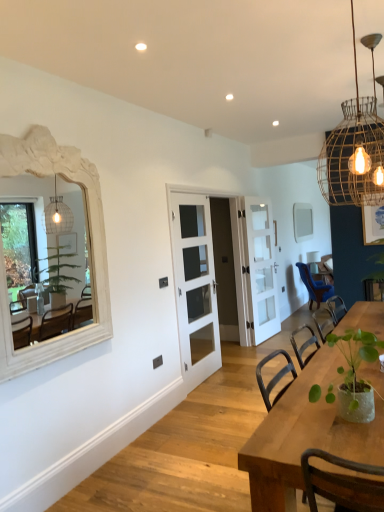
The image size is (384, 512). Describe the element at coordinates (261, 268) in the screenshot. I see `white glossy door at center, placed as the third door when sorted from front to back` at that location.

What is the approximate width of white glass door at center, the first door positioned from the front?

The width of white glass door at center, the first door positioned from the front, is 3.09 inches.

This screenshot has height=512, width=384. Identify the location of white glossy door at center, placed as the third door when sorted from front to back. (261, 268).

Looking at this image, based on their positions, is wooden table at center located to the left or right of green matte plant at lower right?

From the image, it's evident that wooden table at center is to the right of green matte plant at lower right.

Is wooden table at center inside or outside of green matte plant at lower right?

wooden table at center is spatially situated outside green matte plant at lower right.

From the image's perspective, is wooden table at center on top of green matte plant at lower right?

No, from the image's perspective, wooden table at center is not over green matte plant at lower right.

The image size is (384, 512). There is a white glass door at center, the 3th door positioned from the back. Find the location of `the 1st mirror above it (from the image's perspective)`. the 1st mirror above it (from the image's perspective) is located at coordinates (90, 246).

Which point is more forward, (245, 345) or (6, 320)?

Point (6, 320)

Is white glass door at center, the 3th door positioned from the back, spatially inside white carved wood mirror at left, arranged as the first mirror when viewed from the front, or outside of it?

white glass door at center, the 3th door positioned from the back, cannot be found inside white carved wood mirror at left, arranged as the first mirror when viewed from the front.

Could you measure the distance between white glass door at center, the 3th door positioned from the back, and white carved wood mirror at left, which appears as the second mirror when viewed from the right?

white glass door at center, the 3th door positioned from the back, is 4.66 feet away from white carved wood mirror at left, which appears as the second mirror when viewed from the right.

What's the angular difference between green matte plant at lower right and white carved wood mirror at left, arranged as the first mirror when viewed from the front,'s facing directions?

The angular difference between green matte plant at lower right and white carved wood mirror at left, arranged as the first mirror when viewed from the front, is 86.1 degrees.

Between green matte plant at lower right and white carved wood mirror at left, which appears as the second mirror when viewed from the right, which one appears on the left side from the viewer's perspective?

white carved wood mirror at left, which appears as the second mirror when viewed from the right, is more to the left.

Is green matte plant at lower right wider than white carved wood mirror at left, the 1th mirror when ordered from left to right?

Yes.

Looking at this image, is green matte plant at lower right inside or outside of white carved wood mirror at left, arranged as the first mirror when viewed from the front?

green matte plant at lower right is outside white carved wood mirror at left, arranged as the first mirror when viewed from the front.

Based on the photo, is green matte plant at lower right smaller than wooden table at center?

Correct, green matte plant at lower right occupies less space than wooden table at center.

Considering the sizes of objects green matte plant at lower right and wooden table at center in the image provided, who is thinner, green matte plant at lower right or wooden table at center?

green matte plant at lower right is thinner.

Is wooden table at center at the back of green matte plant at lower right?

Yes, green matte plant at lower right is positioned with its back facing wooden table at center.

Is green matte plant at lower right directly adjacent to wooden table at center?

green matte plant at lower right and wooden table at center are clearly separated.

Which object is more forward, white glass door at center, the second door positioned from the back, or white glass door at center, the 3th door positioned from the back?

white glass door at center, the 3th door positioned from the back, is in front.

Looking at this image, considering the relative sizes of white glass door at center, the second door positioned from the back, and white glass door at center, the first door positioned from the front, in the image provided, is white glass door at center, the second door positioned from the back, bigger than white glass door at center, the first door positioned from the front,?

Actually, white glass door at center, the second door positioned from the back, might be smaller than white glass door at center, the first door positioned from the front.

Does white glass door at center, the second door positioned from the back, have a greater width compared to white glass door at center, the 3th door positioned from the back?

Yes.

Could you measure the distance between white matte mirror at upper center, the 2th mirror in the left-to-right sequence, and white carved wood mirror at left, the 1th mirror when ordered from left to right?

They are 4.20 meters apart.

Looking at this image, which of these two, white matte mirror at upper center, the first mirror from the right, or white carved wood mirror at left, arranged as the first mirror when viewed from the front, is bigger?

Bigger between the two is white carved wood mirror at left, arranged as the first mirror when viewed from the front.

From the picture: How different are the orientations of white matte mirror at upper center, the 1th mirror from the back, and white carved wood mirror at left, arranged as the first mirror when viewed from the front, in degrees?

The angular difference between white matte mirror at upper center, the 1th mirror from the back, and white carved wood mirror at left, arranged as the first mirror when viewed from the front, is 1.48 degrees.

Is white matte mirror at upper center, which ranks as the 2th mirror in front-to-back order, in contact with white carved wood mirror at left, which ranks as the 2th mirror in back-to-front order?

No, white matte mirror at upper center, which ranks as the 2th mirror in front-to-back order, is not touching white carved wood mirror at left, which ranks as the 2th mirror in back-to-front order.

Is white carved wood mirror at left, the 1th mirror when ordered from left to right, taller than white glossy door at center, placed as the third door when sorted from front to back?

No.

From a real-world perspective, which object stands above the other?

white carved wood mirror at left, which ranks as the 2th mirror in back-to-front order, is physically above.

Does white carved wood mirror at left, which appears as the second mirror when viewed from the right, have a smaller size compared to white glossy door at center, which appears as the first door when viewed from the back?

Incorrect, white carved wood mirror at left, which appears as the second mirror when viewed from the right, is not smaller in size than white glossy door at center, which appears as the first door when viewed from the back.

You are a GUI agent. You are given a task and a screenshot of the screen. Output one action in this format:
    pyautogui.click(x=<x>, y=<y>)
    Task: Click on the table on the right of the green matte plant at lower right
    The image size is (384, 512).
    Given the screenshot: What is the action you would take?
    tap(305, 436)

From the image's perspective, count 1st mirrors upward from the white glass door at center, the 3th door positioned from the back, and point to it. Please provide its 2D coordinates.

[(90, 246)]

Estimate the real-world distances between objects in this image. Which object is further from white glossy door at center, which appears as the first door when viewed from the back, white glass door at center, the first door positioned from the front, or blue velvet chair at right?

white glass door at center, the first door positioned from the front, is further to white glossy door at center, which appears as the first door when viewed from the back.

Based on their spatial positions, is wooden table at center or white matte mirror at upper center, the 2th mirror in the left-to-right sequence, closer to white carved wood mirror at left, which appears as the second mirror when viewed from the right?

wooden table at center.

From the picture: When comparing their distances from blue velvet chair at right, does green matte plant at lower right or white glass door at center, the first door positioned from the front, seem further?

green matte plant at lower right.

Looking at the image, which one is located further to white glass door at center, the first door positioned from the front, white glossy door at center, which appears as the first door when viewed from the back, or bamboo wire chandelier at upper right?

bamboo wire chandelier at upper right lies further to white glass door at center, the first door positioned from the front, than the other object.

Estimate the real-world distances between objects in this image. Which object is closer to white carved wood mirror at left, arranged as the first mirror when viewed from the front, white glossy door at center, placed as the third door when sorted from front to back, or wooden table at center?

wooden table at center lies closer to white carved wood mirror at left, arranged as the first mirror when viewed from the front, than the other object.

Estimate the real-world distances between objects in this image. Which object is further from white carved wood mirror at left, the 1th mirror when ordered from left to right, bamboo wire chandelier at upper right or green matte plant at lower right?

green matte plant at lower right.

Estimate the real-world distances between objects in this image. Which object is closer to white carved wood mirror at left, arranged as the first mirror when viewed from the front, white glass door at center, the first door positioned from the front, or blue velvet chair at right?

Based on the image, white glass door at center, the first door positioned from the front, appears to be nearer to white carved wood mirror at left, arranged as the first mirror when viewed from the front.

Which object lies further to the anchor point green matte plant at lower right, white glossy door at center, placed as the third door when sorted from front to back, or white glass door at center, the 2th door viewed from the front?

The object further to green matte plant at lower right is white glossy door at center, placed as the third door when sorted from front to back.

This screenshot has width=384, height=512. Identify the location of mirror between bamboo wire chandelier at upper right and white glass door at center, the 3th door positioned from the back, from front to back. (90, 246).

I want to click on mirror between wooden table at center and white matte mirror at upper center, which ranks as the 2th mirror in front-to-back order, along the z-axis, so click(x=90, y=246).

Where is `mirror between wooden table at center and white glass door at center, the 3th door positioned from the back, along the z-axis`? The height and width of the screenshot is (512, 384). mirror between wooden table at center and white glass door at center, the 3th door positioned from the back, along the z-axis is located at coordinates (90, 246).

Locate an element on the screen. door between white carved wood mirror at left, the 1th mirror when ordered from left to right, and white glass door at center, the second door positioned from the back, along the z-axis is located at coordinates (194, 283).